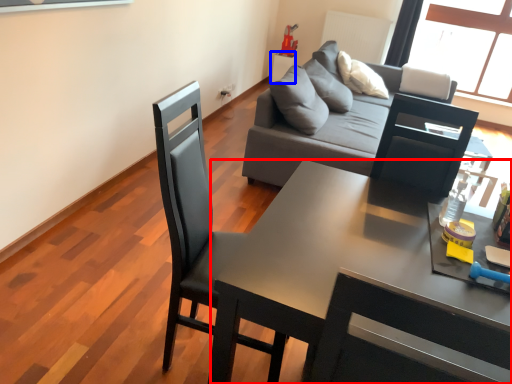
Question: Which object appears farthest to the camera in this image, desk (highlighted by a red box) or side table (highlighted by a blue box)?

Choices:
 (A) desk
 (B) side table

Answer: (B)